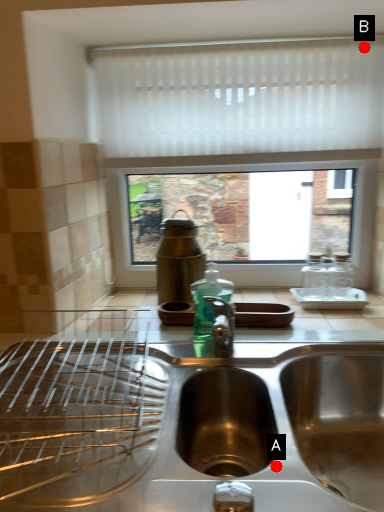
Question: Two points are circled on the image, labeled by A and B beside each circle. Which point appears closest to the camera in this image?

Choices:
 (A) A is closer
 (B) B is closer

Answer: (A)